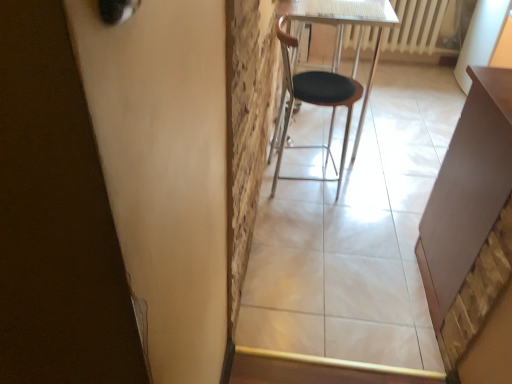
At what (x,y) coordinates should I click in order to perform the action: click on vacant region to the left of matte brown table at right. Please return your answer as a coordinate pair (x, y). This screenshot has height=384, width=512. Looking at the image, I should click on (x=374, y=283).